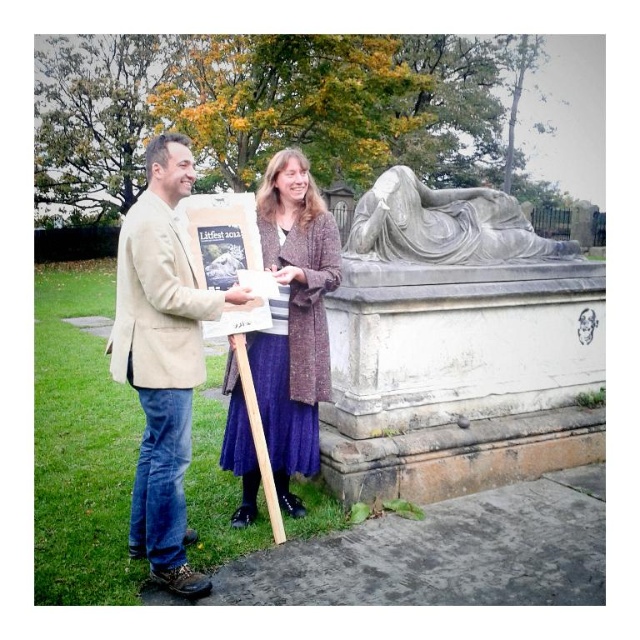
Question: Can you confirm if beige fabric jacket at center is positioned to the left of velvet purple skirt at center?

Choices:
 (A) yes
 (B) no

Answer: (A)

Question: Which is nearer to the white marble statue at right?

Choices:
 (A) beige fabric jacket at center
 (B) velvet purple skirt at center

Answer: (B)

Question: Which point is farther to the camera?

Choices:
 (A) beige fabric jacket at center
 (B) white marble statue at right

Answer: (B)

Question: Which point appears closest to the camera in this image?

Choices:
 (A) (513, 204)
 (B) (179, 397)
 (C) (248, 444)

Answer: (B)

Question: Is beige fabric jacket at center above velvet purple skirt at center?

Choices:
 (A) no
 (B) yes

Answer: (A)

Question: Can you confirm if beige fabric jacket at center is positioned above velvet purple skirt at center?

Choices:
 (A) no
 (B) yes

Answer: (A)